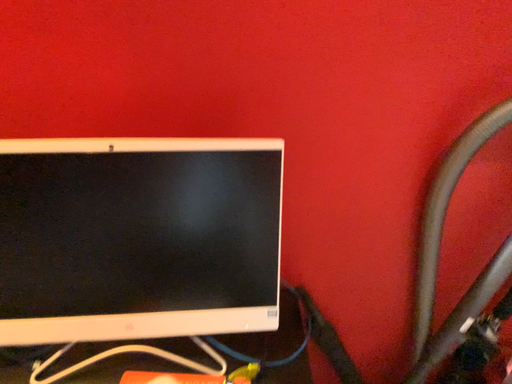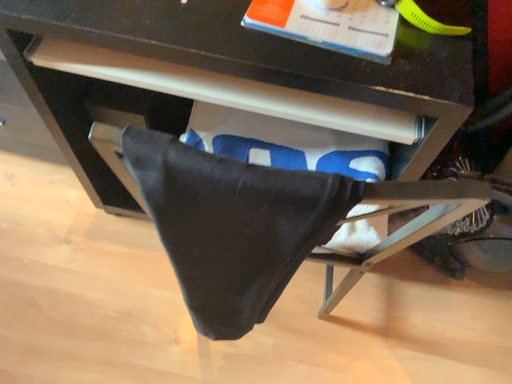
Question: How did the camera likely rotate when shooting the video?

Choices:
 (A) rotated upward
 (B) rotated downward

Answer: (B)